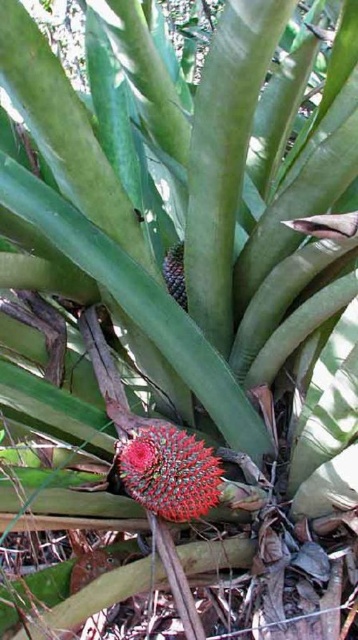
Based on the photo, which of these two, shiny red spiky fruit at center or satin purple pineapple at center, stands taller?

satin purple pineapple at center is taller.

Is shiny red spiky fruit at center positioned before satin purple pineapple at center?

Yes, shiny red spiky fruit at center is closer to the viewer.

The height and width of the screenshot is (640, 358). In order to click on shiny red spiky fruit at center in this screenshot , I will do `click(168, 472)`.